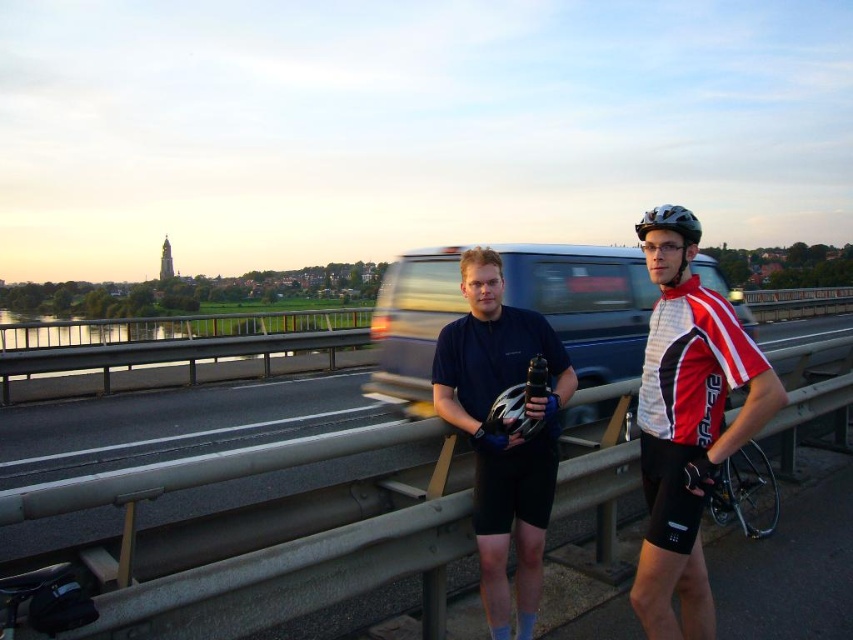
Question: Which point is farther to the camera?

Choices:
 (A) (643, 419)
 (B) (561, 310)
 (C) (494, 324)

Answer: (B)

Question: Which point is closer to the camera taking this photo?

Choices:
 (A) (683, 240)
 (B) (496, 246)
 (C) (704, 412)

Answer: (C)

Question: Is red and white jersey at center wider than matte black helmet at center?

Choices:
 (A) yes
 (B) no

Answer: (A)

Question: Is dark blue jersey at center closer to camera compared to matte black helmet at center?

Choices:
 (A) no
 (B) yes

Answer: (A)

Question: Among these points, which one is farthest from the camera?

Choices:
 (A) (509, 435)
 (B) (675, 205)
 (C) (744, 484)

Answer: (C)

Question: Can you confirm if dark blue jersey at center is thinner than matte black helmet at upper right?

Choices:
 (A) yes
 (B) no

Answer: (A)